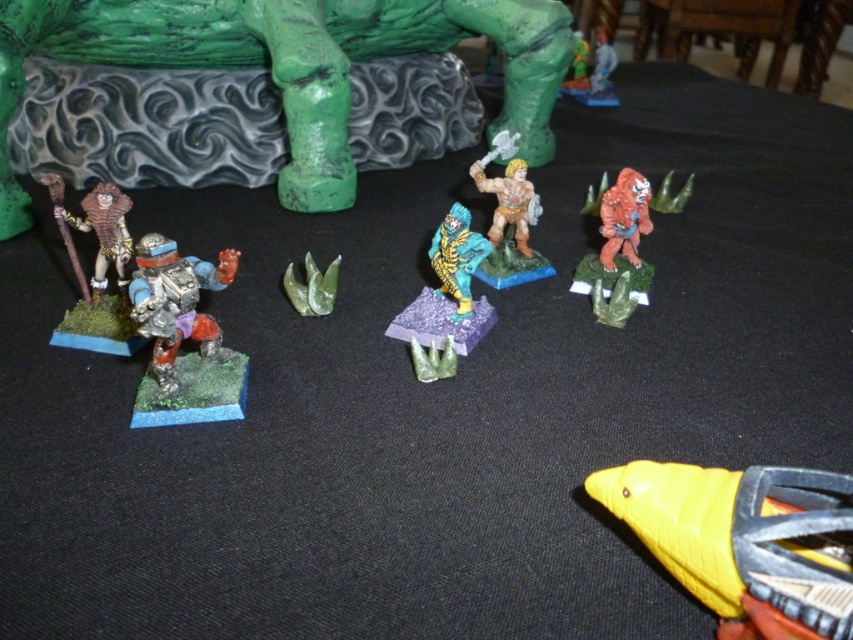
Is teal metallic figure at center wider than brown matte figure at left?

Indeed, teal metallic figure at center has a greater width compared to brown matte figure at left.

The image size is (853, 640). In order to click on teal metallic figure at center in this screenshot , I will do `click(445, 300)`.

Is matte plastic figure at center thinner than green rubber plant at center?

No.

Based on the photo, who is positioned more to the right, matte plastic figure at center or green rubber plant at center?

From the viewer's perspective, matte plastic figure at center appears more on the right side.

Between point (496, 188) and point (322, 305), which one is positioned in front?

Point (322, 305) is in front.

Locate an element on the screen. matte plastic figure at center is located at coordinates (508, 192).

Does yellow matte bird at center have a lesser width compared to teal matte figure at center?

No, yellow matte bird at center is not thinner than teal matte figure at center.

Based on the photo, who is shorter, yellow matte bird at center or teal matte figure at center?

With less height is yellow matte bird at center.

Is point (734, 566) positioned in front of point (456, 232)?

That is True.

You are a GUI agent. You are given a task and a screenshot of the screen. Output one action in this format:
    pyautogui.click(x=<x>, y=<y>)
    Task: Click on the yellow matte bird at center
    This screenshot has height=640, width=853.
    Given the screenshot: What is the action you would take?
    point(744,538)